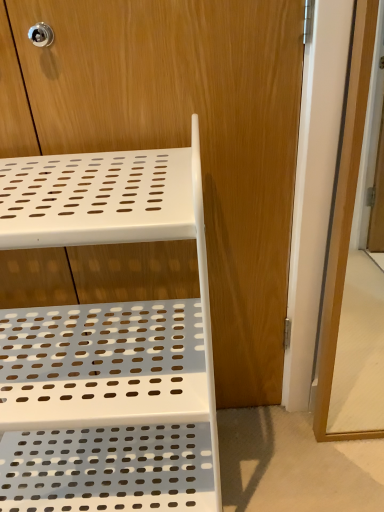
Question: Is white plastic shelf at upper left aimed at white plastic shelf at center?

Choices:
 (A) no
 (B) yes

Answer: (B)

Question: Is white plastic shelf at upper left oriented away from white plastic shelf at center?

Choices:
 (A) no
 (B) yes

Answer: (B)

Question: Does white plastic shelf at upper left appear on the left side of white plastic shelf at center?

Choices:
 (A) yes
 (B) no

Answer: (A)

Question: From the image's perspective, is white plastic shelf at upper left on top of white plastic shelf at center?

Choices:
 (A) yes
 (B) no

Answer: (B)

Question: Is white plastic shelf at upper left smaller than white plastic shelf at center?

Choices:
 (A) no
 (B) yes

Answer: (A)

Question: From a real-world perspective, is white plastic shelf at upper left located higher than white plastic shelf at center?

Choices:
 (A) no
 (B) yes

Answer: (A)

Question: Can you confirm if white plastic shelf at center is thinner than transparent glass screen door at right?

Choices:
 (A) no
 (B) yes

Answer: (B)

Question: Is white plastic shelf at center in front of transparent glass screen door at right?

Choices:
 (A) yes
 (B) no

Answer: (B)

Question: Would you say transparent glass screen door at right is part of white plastic shelf at center's contents?

Choices:
 (A) yes
 (B) no

Answer: (B)

Question: Is white plastic shelf at center oriented towards transparent glass screen door at right?

Choices:
 (A) yes
 (B) no

Answer: (B)

Question: Does white plastic shelf at center have a smaller size compared to transparent glass screen door at right?

Choices:
 (A) no
 (B) yes

Answer: (A)

Question: Can you confirm if white plastic shelf at center is shorter than transparent glass screen door at right?

Choices:
 (A) no
 (B) yes

Answer: (A)

Question: Does transparent glass screen door at right have a smaller size compared to white plastic shelf at upper left?

Choices:
 (A) yes
 (B) no

Answer: (A)